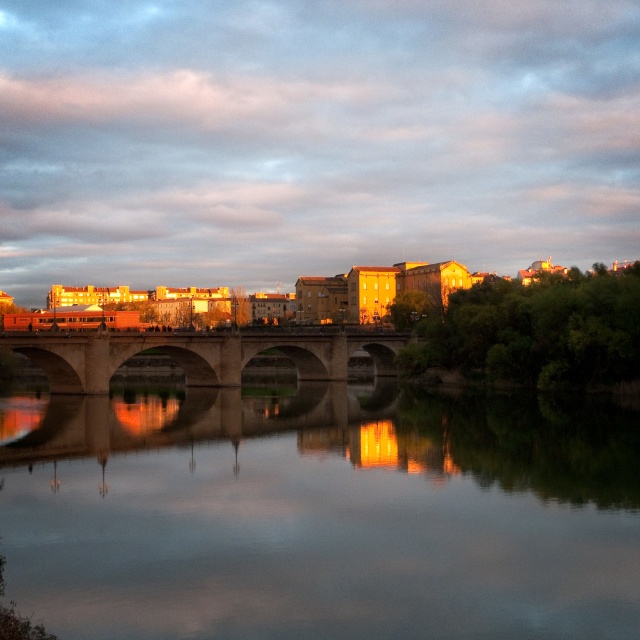
Question: Can you confirm if smooth reflective water at center is bigger than stone bridge at center?

Choices:
 (A) yes
 (B) no

Answer: (B)

Question: Can you confirm if smooth reflective water at center is positioned to the left of stone bridge at center?

Choices:
 (A) no
 (B) yes

Answer: (A)

Question: Which object is closer to the camera taking this photo?

Choices:
 (A) smooth reflective water at center
 (B) stone bridge at center

Answer: (A)

Question: Which object appears farthest from the camera in this image?

Choices:
 (A) smooth reflective water at center
 (B) stone bridge at center

Answer: (B)

Question: Is smooth reflective water at center thinner than stone bridge at center?

Choices:
 (A) no
 (B) yes

Answer: (A)